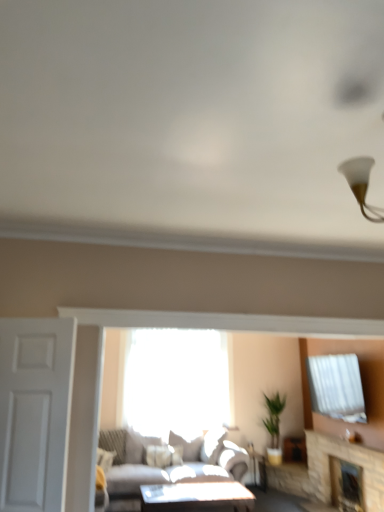
Question: From a real-world perspective, is stone fireplace at lower right, the first fireplace from the back, positioned under white matte door at left based on gravity?

Choices:
 (A) yes
 (B) no

Answer: (A)

Question: Is stone fireplace at lower right, the first fireplace from the back, oriented away from white matte door at left?

Choices:
 (A) yes
 (B) no

Answer: (B)

Question: Is the surface of stone fireplace at lower right, marked as the second fireplace in a front-to-back arrangement, in direct contact with white matte door at left?

Choices:
 (A) no
 (B) yes

Answer: (A)

Question: Would you say stone fireplace at lower right, marked as the second fireplace in a front-to-back arrangement, is outside white matte door at left?

Choices:
 (A) yes
 (B) no

Answer: (A)

Question: Does stone fireplace at lower right, marked as the second fireplace in a front-to-back arrangement, come behind white matte door at left?

Choices:
 (A) no
 (B) yes

Answer: (B)

Question: Is stone fireplace at lower right, marked as the second fireplace in a front-to-back arrangement, thinner than white matte door at left?

Choices:
 (A) no
 (B) yes

Answer: (A)

Question: Is light gray fabric couch at center located within white matte door at left?

Choices:
 (A) no
 (B) yes

Answer: (A)

Question: Can you confirm if white matte door at left is shorter than light gray fabric couch at center?

Choices:
 (A) yes
 (B) no

Answer: (B)

Question: Is white matte door at left oriented towards light gray fabric couch at center?

Choices:
 (A) yes
 (B) no

Answer: (B)

Question: Can you confirm if white matte door at left is thinner than light gray fabric couch at center?

Choices:
 (A) no
 (B) yes

Answer: (B)

Question: Is white matte door at left looking in the opposite direction of light gray fabric couch at center?

Choices:
 (A) yes
 (B) no

Answer: (A)

Question: Is white matte door at left at the left side of light gray fabric couch at center?

Choices:
 (A) yes
 (B) no

Answer: (A)

Question: Could stone fireplace at lower right, the second fireplace in the back-to-front sequence, be considered to be inside matte white table at center?

Choices:
 (A) no
 (B) yes

Answer: (A)